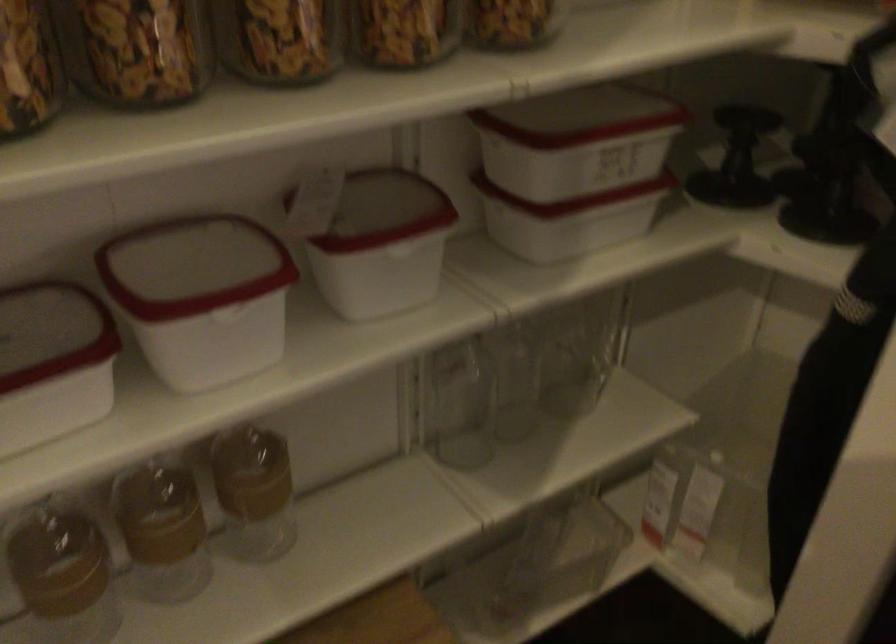
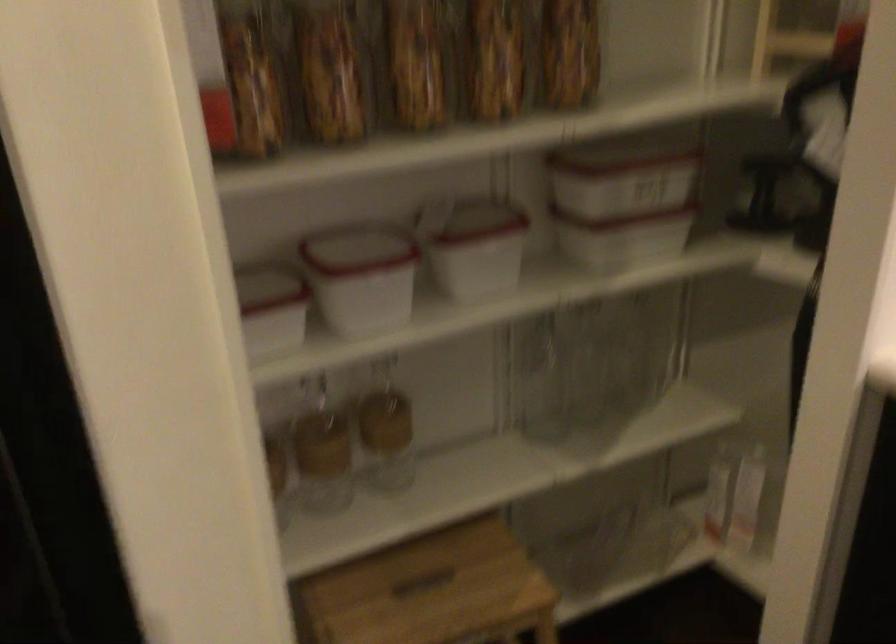
The point at [204,310] is marked in the first image. Where is the corresponding point in the second image?

(362, 277)